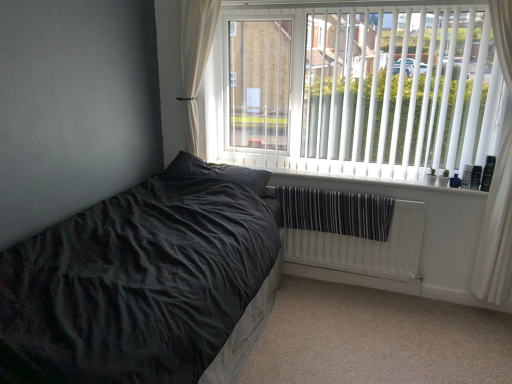
Question: Considering the relative sizes of white sheer curtain at upper left, the 2th curtain viewed from the right, and white vertical blinds at upper right in the image provided, is white sheer curtain at upper left, the 2th curtain viewed from the right, shorter than white vertical blinds at upper right?

Choices:
 (A) no
 (B) yes

Answer: (B)

Question: From the image's perspective, is white sheer curtain at upper left, the 2th curtain viewed from the right, located above white vertical blinds at upper right?

Choices:
 (A) no
 (B) yes

Answer: (B)

Question: Can you confirm if white sheer curtain at upper left, the 2th curtain viewed from the right, is wider than white vertical blinds at upper right?

Choices:
 (A) yes
 (B) no

Answer: (A)

Question: Is white sheer curtain at upper left, the 2th curtain viewed from the right, outside white vertical blinds at upper right?

Choices:
 (A) no
 (B) yes

Answer: (B)

Question: From a real-world perspective, is white sheer curtain at upper left, the 2th curtain viewed from the right, positioned over white vertical blinds at upper right based on gravity?

Choices:
 (A) yes
 (B) no

Answer: (A)

Question: Is white vertical blinds at upper right at the back of white sheer curtain at upper left, the 2th curtain viewed from the right?

Choices:
 (A) no
 (B) yes

Answer: (A)

Question: Is white textured radiator at lower right at the back of white sheer curtain at right, marked as the first curtain in a right-to-left arrangement?

Choices:
 (A) no
 (B) yes

Answer: (A)

Question: Is white textured radiator at lower right located within white sheer curtain at right, marked as the first curtain in a right-to-left arrangement?

Choices:
 (A) yes
 (B) no

Answer: (B)

Question: Is white sheer curtain at right, the 2th curtain positioned from the left, taller than white textured radiator at lower right?

Choices:
 (A) no
 (B) yes

Answer: (B)

Question: Are white sheer curtain at right, marked as the first curtain in a right-to-left arrangement, and white textured radiator at lower right located far from each other?

Choices:
 (A) yes
 (B) no

Answer: (B)

Question: Does white sheer curtain at right, marked as the first curtain in a right-to-left arrangement, have a lesser width compared to white textured radiator at lower right?

Choices:
 (A) yes
 (B) no

Answer: (B)

Question: Is white sheer curtain at right, marked as the first curtain in a right-to-left arrangement, facing towards white textured radiator at lower right?

Choices:
 (A) no
 (B) yes

Answer: (A)

Question: Would you say velvet black bed at lower left is part of white textured radiator at lower right's contents?

Choices:
 (A) yes
 (B) no

Answer: (B)